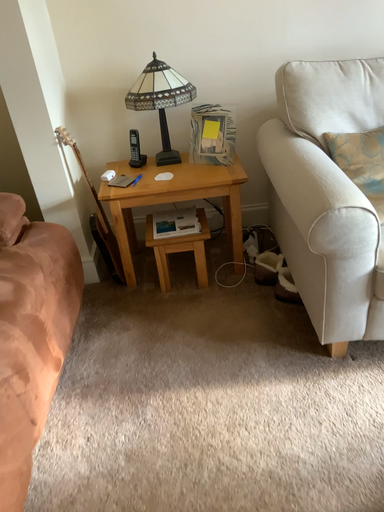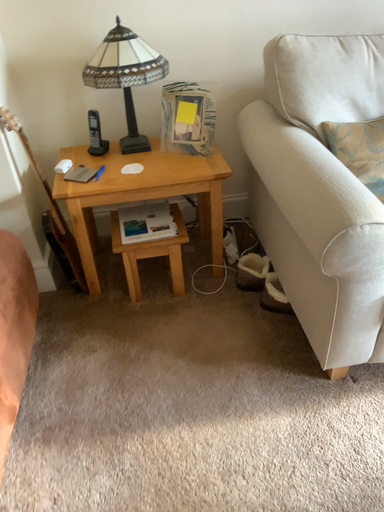
Question: Which way did the camera rotate in the video?

Choices:
 (A) rotated right
 (B) rotated left

Answer: (A)